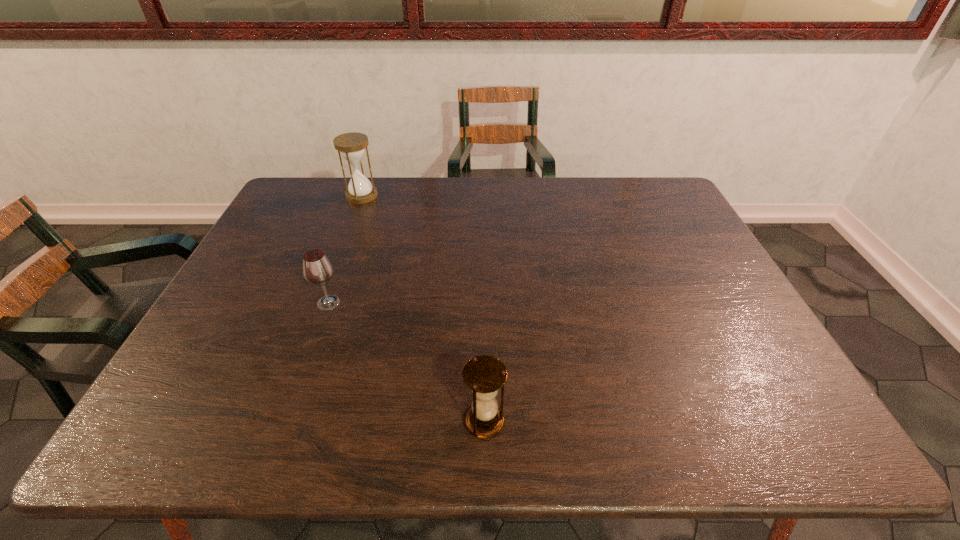
Locate an element on the screen. blank space at the far edge is located at coordinates (547, 200).

Find the location of a particular element. The height and width of the screenshot is (540, 960). vacant space at the near edge of the desktop is located at coordinates (630, 416).

You are a GUI agent. You are given a task and a screenshot of the screen. Output one action in this format:
    pyautogui.click(x=<x>, y=<y>)
    Task: Click on the vacant area at the left edge
    The height and width of the screenshot is (540, 960).
    Given the screenshot: What is the action you would take?
    pyautogui.click(x=252, y=286)

Locate an element on the screen. The image size is (960, 540). vacant space at the right edge of the desktop is located at coordinates (722, 309).

Find the location of a particular element. Image resolution: width=960 pixels, height=540 pixels. free space at the far left corner of the desktop is located at coordinates (317, 197).

This screenshot has width=960, height=540. What are the coordinates of `free space between the second nearest object and the nearer hourglass` in the screenshot? It's located at click(406, 362).

At what (x,y) coordinates should I click in order to perform the action: click on vacant area that lies between the left hourglass and the nearest object. Please return your answer as a coordinate pair (x, y). Looking at the image, I should click on (423, 308).

Find the location of a particular element. vacant space in between the rightmost object and the left hourglass is located at coordinates (423, 308).

Locate an element on the screen. free spot between the farthest object and the wineglass is located at coordinates (346, 249).

This screenshot has width=960, height=540. What are the coordinates of `unoccupied position between the wineglass and the taller hourglass` in the screenshot? It's located at (346, 249).